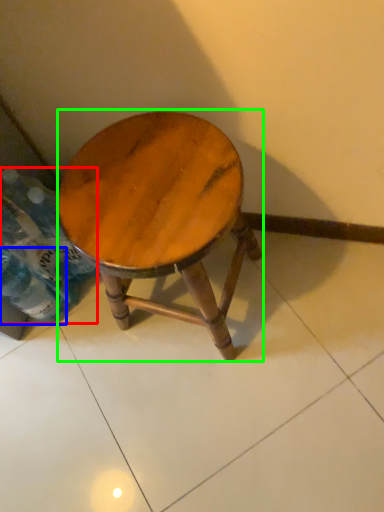
Question: Based on their relative distances, which object is farther from bottle (highlighted by a red box)? Choose from bottle (highlighted by a blue box) and stool (highlighted by a green box).

Choices:
 (A) bottle
 (B) stool

Answer: (B)